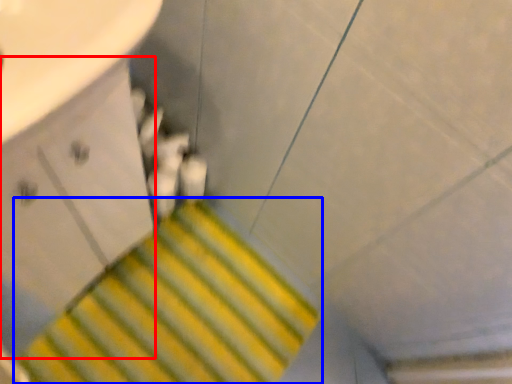
Question: Which point is closer to the camera, drawer (highlighted by a red box) or stairs (highlighted by a blue box)?

Choices:
 (A) drawer
 (B) stairs

Answer: (A)